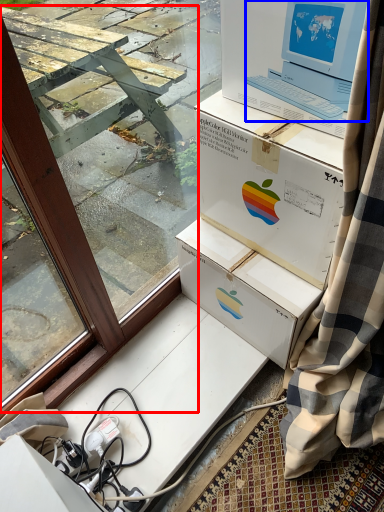
Question: Which object is further to the camera taking this photo, window frame (highlighted by a red box) or laptop (highlighted by a blue box)?

Choices:
 (A) window frame
 (B) laptop

Answer: (B)